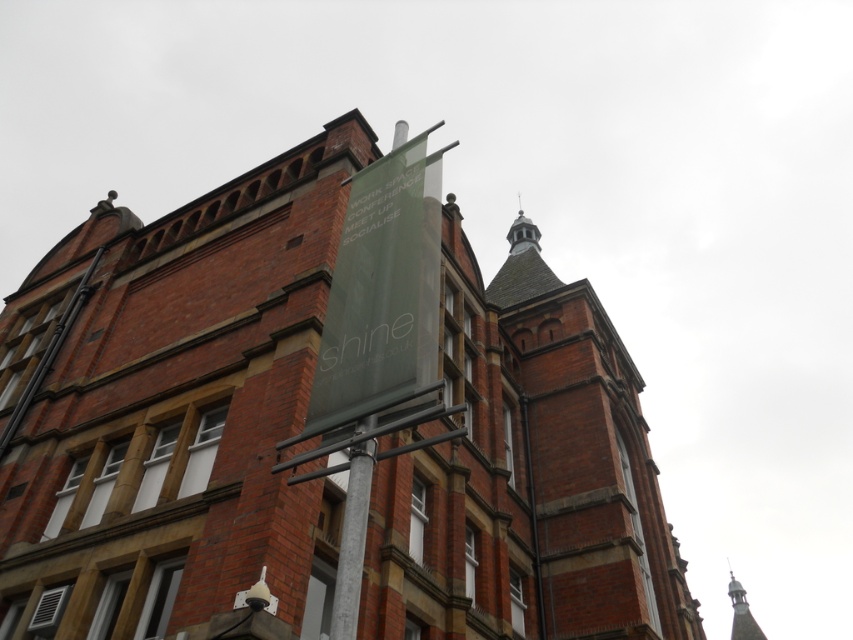
Who is shorter, green fabric banner at center or red brick tower at upper center?

With less height is green fabric banner at center.

Does point (271, 541) come behind point (589, 417)?

That is False.

The width and height of the screenshot is (853, 640). Identify the location of green fabric banner at center. (173, 410).